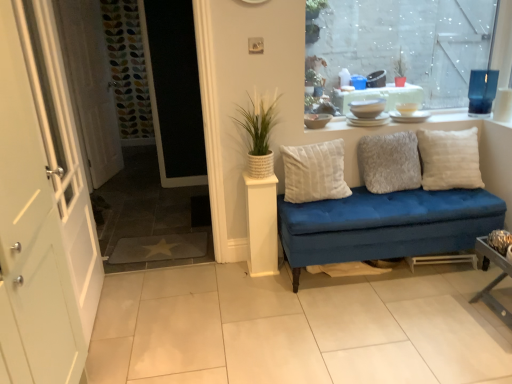
Image resolution: width=512 pixels, height=384 pixels. What are the coordinates of `free space to the left of metallic silver table at lower right, the first table viewed from the front` in the screenshot? It's located at (456, 319).